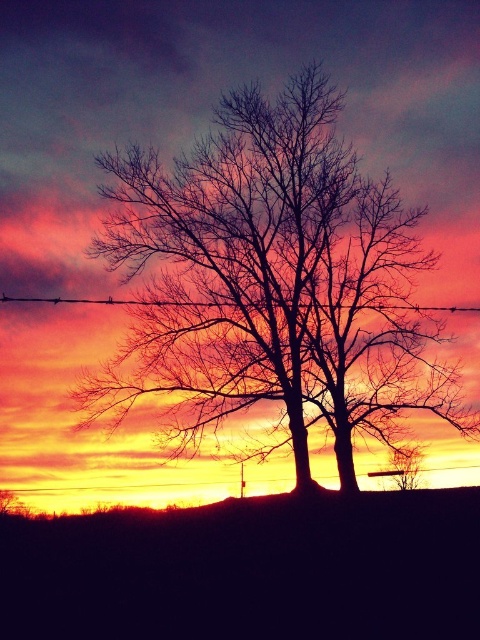
You are a hiker who has just arrived at this scenic spot. You notice barbed wire at center and a bare wood tree at lower right. Which object is positioned more to the east if the sun is setting in the west?

The barbed wire at center is to the left of the bare wood tree at lower right. Since the sun is setting in the west, the tree at lower right would cast a shadow towards the east. Therefore, the barbed wire at center is positioned more to the east compared to the bare wood tree at lower right.

You are an artist painting this rural scene. You want to place a small bird in the sky between the two points, point (272, 298) and point (395, 480). Which point should you place the bird closer to so it appears in front of the trees?

You should place the bird closer to point (272, 298) because it is closer to the viewer than point (395, 480). This will make the bird appear in front of the trees.

You are a painter standing at the base of the hill in the rural scene. You want to paint both the bare branches at center and the bare wood tree at lower right in your artwork. Considering your current position, which tree is closer to you?

The bare wood tree at lower right is closer to you since it is positioned lower in the image, which typically indicates proximity in such compositions.